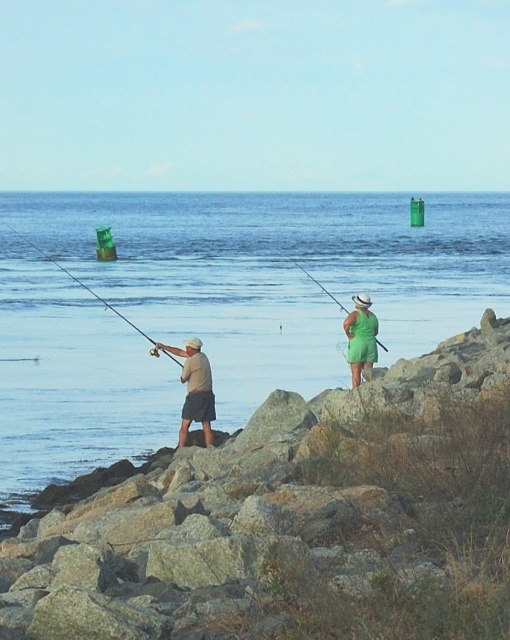
Question: Is green fabric dress at center positioned before matte black fishing pole at left?

Choices:
 (A) yes
 (B) no

Answer: (B)

Question: Which object appears closest to the camera in this image?

Choices:
 (A) blue water at center
 (B) matte black fishing pole at left

Answer: (A)

Question: Does green fabric dress at center appear on the right side of green fabric fishing pole at center?

Choices:
 (A) yes
 (B) no

Answer: (B)

Question: Which point is closer to the camera?

Choices:
 (A) green fabric fishing pole at center
 (B) green fabric dress at center
 (C) matte black fishing pole at left
 (D) tan cotton shirt at center

Answer: (D)

Question: Which point is closer to the camera?

Choices:
 (A) (108, 248)
 (B) (358, 381)

Answer: (B)

Question: Does tan cotton shirt at center have a smaller size compared to green fabric fishing pole at center?

Choices:
 (A) no
 (B) yes

Answer: (B)